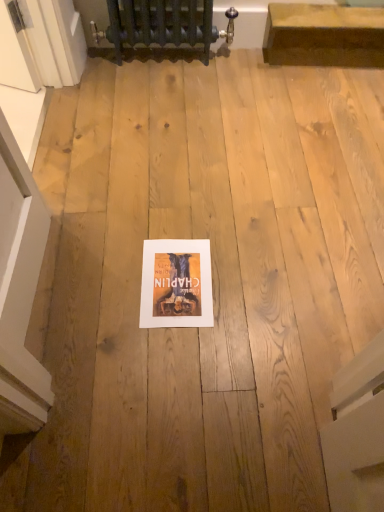
Where is `vacant space to the right of matte paper poster at center`? This screenshot has height=512, width=384. vacant space to the right of matte paper poster at center is located at coordinates (249, 278).